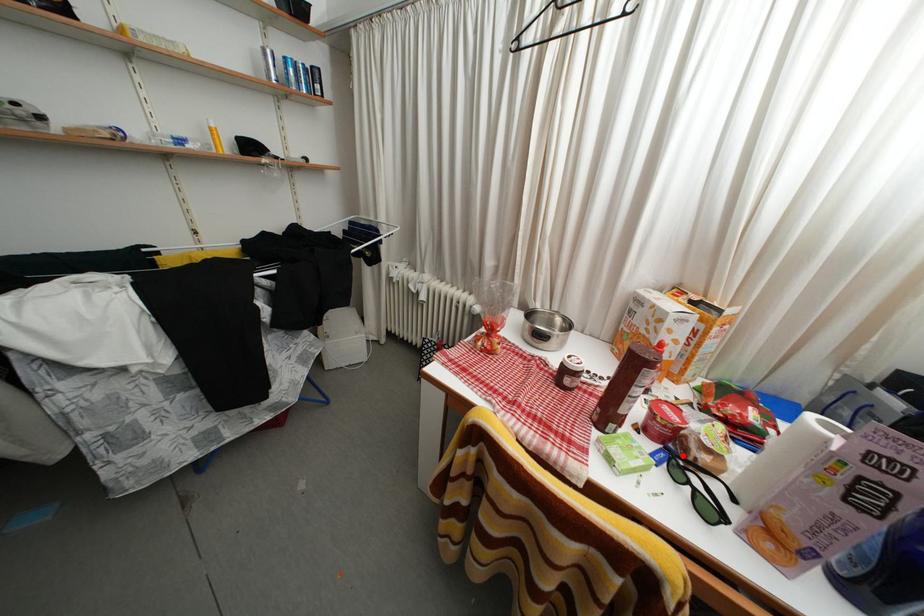
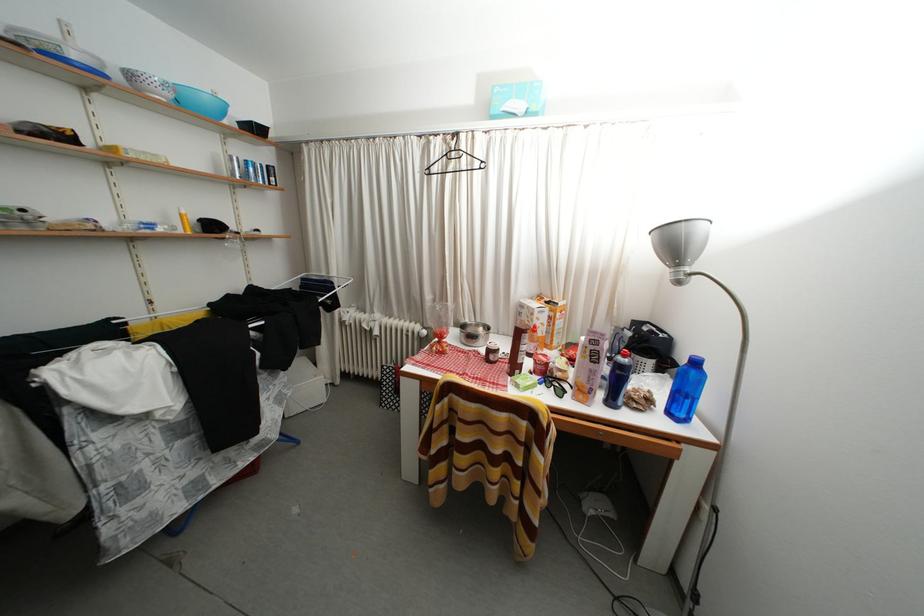
The point at the highlighted location is marked in the first image. Where is the corresponding point in the second image?

(554, 381)